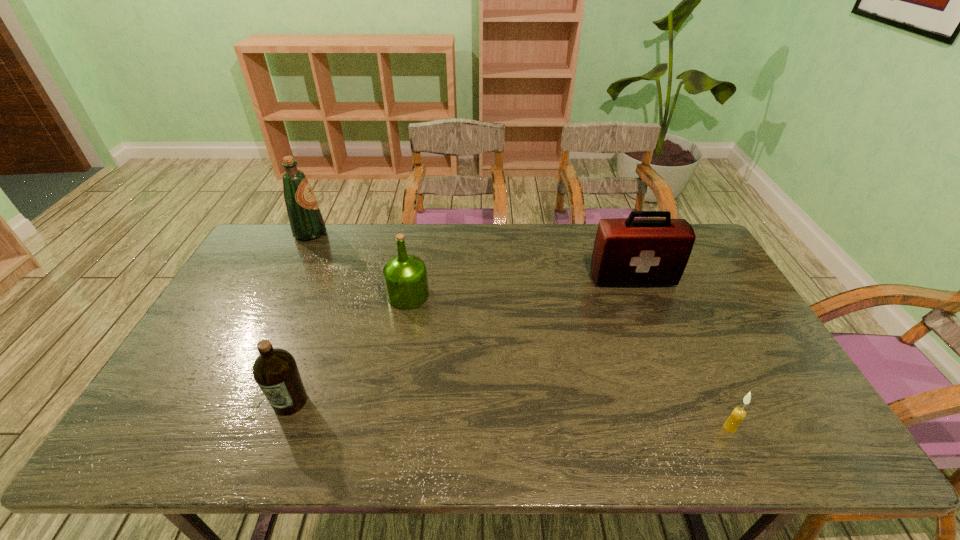
This screenshot has height=540, width=960. What are the coordinates of `free space between the nearest object and the leftmost olive oil` in the screenshot? It's located at (520, 330).

The height and width of the screenshot is (540, 960). What are the coordinates of `vacant region between the nearest olive oil and the first aid kit` in the screenshot? It's located at (461, 340).

Find the location of a particular element. The image size is (960, 540). empty location between the farthest object and the first aid kit is located at coordinates tap(471, 255).

Locate an element on the screen. free spot between the candle and the farthest olive oil is located at coordinates (520, 330).

At what (x,y) coordinates should I click in order to perform the action: click on free space between the nearest object and the farthest olive oil. Please return your answer as a coordinate pair (x, y). The image size is (960, 540). Looking at the image, I should click on (520, 330).

Identify the location of object that ranks as the fourth closest to the first aid kit. (306, 221).

In order to click on the fourth closest object relative to the fourth object from right to left in this screenshot , I will do `click(738, 414)`.

Identify which olive oil is located as the second nearest to the candle. Please provide its 2D coordinates. Your answer should be formatted as a tuple, i.e. [(x, y)], where the tuple contains the x and y coordinates of a point satisfying the conditions above.

[(275, 371)]

Select which olive oil is the closest to the third object from left to right. Please provide its 2D coordinates. Your answer should be formatted as a tuple, i.e. [(x, y)], where the tuple contains the x and y coordinates of a point satisfying the conditions above.

[(275, 371)]

Image resolution: width=960 pixels, height=540 pixels. In order to click on free space that satisfies the following two spatial constraints: 1. on the front side of the second nearest olive oil; 2. on the right side of the nearest object in this screenshot , I will do `click(385, 428)`.